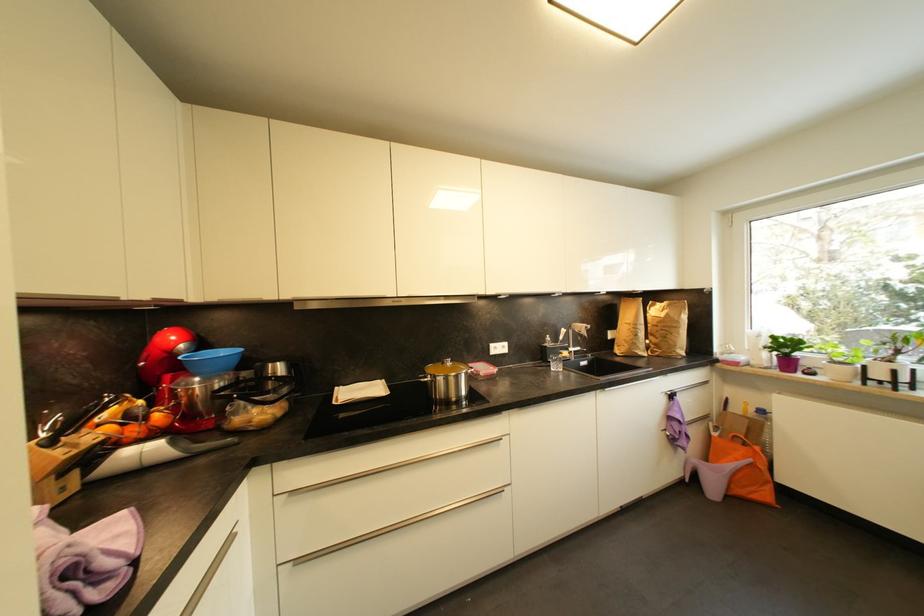
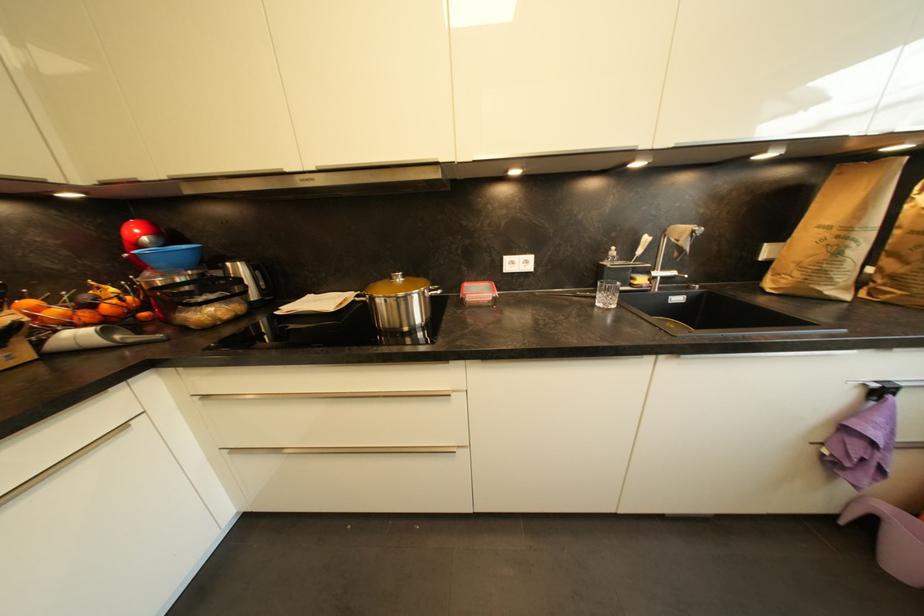
The first image is from the beginning of the video and the second image is from the end. How did the camera likely rotate when shooting the video?

The camera rotated toward left-down.